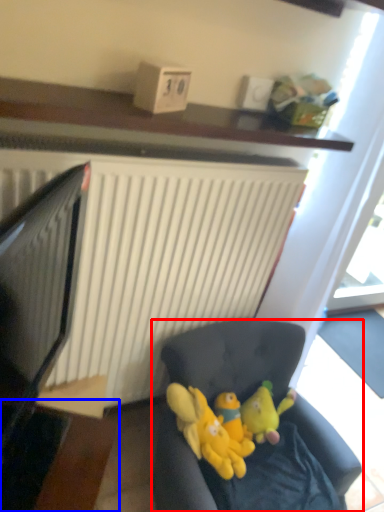
Question: Which of the following is the closest to the observer, studio couch (highlighted by a red box) or table (highlighted by a blue box)?

Choices:
 (A) studio couch
 (B) table

Answer: (B)